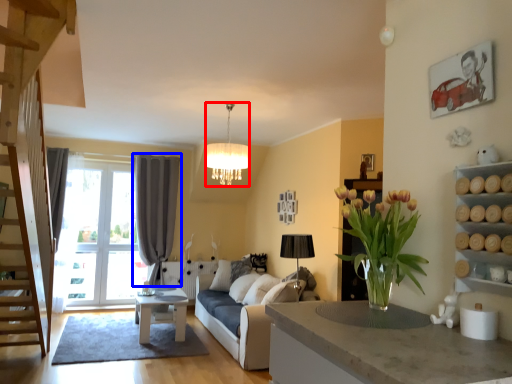
Question: Which object appears closest to the camera in this image, lamp (highlighted by a red box) or curtain (highlighted by a blue box)?

Choices:
 (A) lamp
 (B) curtain

Answer: (A)